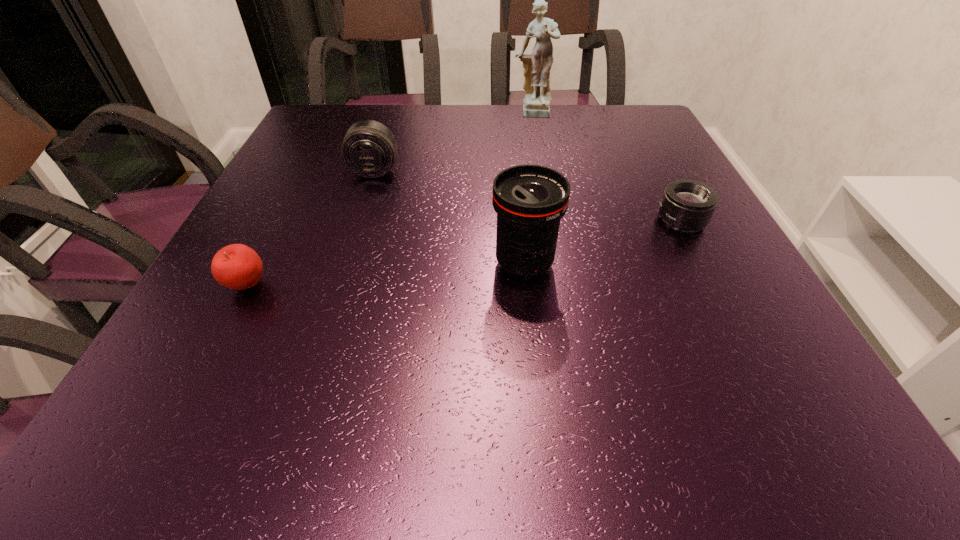
The image size is (960, 540). In order to click on the farthest object in this screenshot , I will do `click(537, 65)`.

Where is `figurine`? figurine is located at coordinates (537, 65).

You are a GUI agent. You are given a task and a screenshot of the screen. Output one action in this format:
    pyautogui.click(x=<x>, y=<y>)
    Task: Click on the second telephoto lens from left to right
    The width and height of the screenshot is (960, 540).
    Given the screenshot: What is the action you would take?
    pyautogui.click(x=530, y=200)

The width and height of the screenshot is (960, 540). In order to click on the tallest telephoto lens in this screenshot , I will do `click(530, 200)`.

Find the location of `the farthest telephoto lens`. the farthest telephoto lens is located at coordinates (369, 148).

Where is `the second shortest telephoto lens`? The image size is (960, 540). the second shortest telephoto lens is located at coordinates (369, 148).

Locate an element on the screen. The height and width of the screenshot is (540, 960). the leftmost object is located at coordinates (236, 266).

In order to click on apple in this screenshot , I will do `click(236, 266)`.

Find the location of a particular element. This screenshot has width=960, height=540. the rightmost telephoto lens is located at coordinates (x=687, y=205).

Find the location of a particular element. the second farthest telephoto lens is located at coordinates (687, 205).